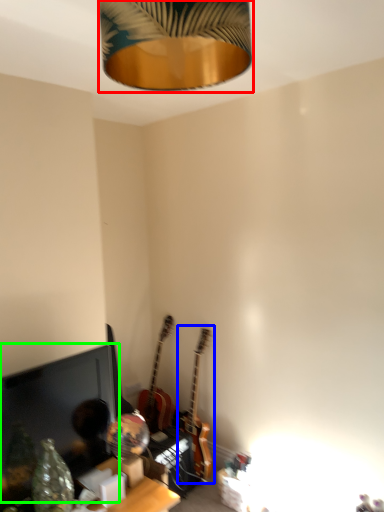
Question: Which object is positioned closest to lamp (highlighted by a red box)? Select from guitar (highlighted by a blue box) and computer monitor (highlighted by a green box).

Choices:
 (A) guitar
 (B) computer monitor

Answer: (B)